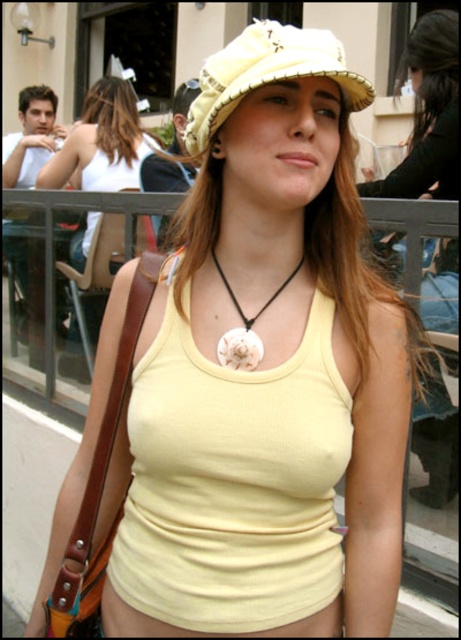
Is beige straw hat at center wider than matte yellow tank top at center?

No, beige straw hat at center is not wider than matte yellow tank top at center.

Between beige straw hat at center and matte yellow tank top at center, which one is positioned lower?

Positioned lower is beige straw hat at center.

Is point (242, 38) farther from viewer compared to point (177, 182)?

No, (242, 38) is closer to viewer.

Locate an element on the screen. beige straw hat at center is located at coordinates (266, 74).

Can you confirm if matte yellow tank top at center is positioned above white shell necklace at center?

Correct, matte yellow tank top at center is located above white shell necklace at center.

Is matte yellow tank top at center shorter than white shell necklace at center?

Incorrect, matte yellow tank top at center's height does not fall short of white shell necklace at center's.

Between point (100, 177) and point (258, 356), which one is positioned behind?

The point (100, 177) is more distant.

The image size is (461, 640). I want to click on matte yellow tank top at center, so click(x=102, y=144).

Is point (205, 122) positioned behind point (242, 356)?

No, it is in front of (242, 356).

What are the coordinates of `beige straw hat at center` in the screenshot? It's located at point(266,74).

Find the location of `beige straw hat at center`. beige straw hat at center is located at coordinates (266, 74).